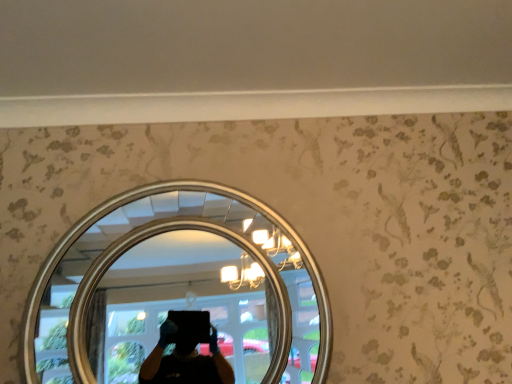
This screenshot has width=512, height=384. I want to click on gold metallic mirror at center, so click(x=176, y=305).

The width and height of the screenshot is (512, 384). What do you see at coordinates (176, 305) in the screenshot?
I see `gold metallic mirror at center` at bounding box center [176, 305].

In order to click on gold metallic mirror at center in this screenshot , I will do (x=176, y=305).